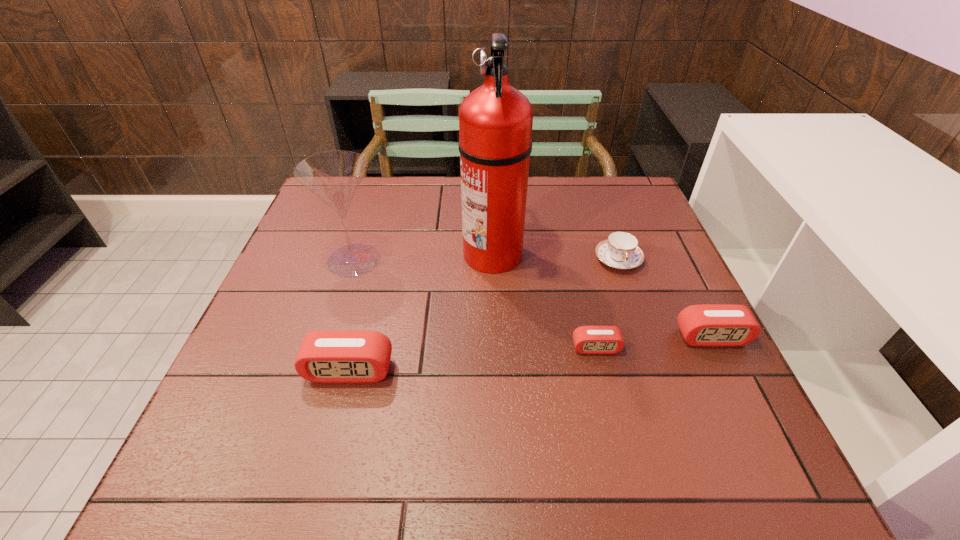
Locate an element on the screen. alarm clock that is at the right edge is located at coordinates (716, 325).

This screenshot has width=960, height=540. I want to click on teacup that is at the right edge, so click(621, 251).

Locate an element on the screen. object that is at the near left corner is located at coordinates (334, 356).

This screenshot has width=960, height=540. Identify the location of vacant space at the far edge of the desktop. (421, 193).

Find the location of a particular element. This screenshot has width=960, height=540. vacant region at the near edge of the desktop is located at coordinates (525, 389).

Image resolution: width=960 pixels, height=540 pixels. Identify the location of free space at the left edge. (303, 326).

Image resolution: width=960 pixels, height=540 pixels. What are the coordinates of `blank area at the right edge` in the screenshot? It's located at (644, 240).

In the image, there is a desktop. Where is `vacant space at the far right corner`? vacant space at the far right corner is located at coordinates (635, 197).

This screenshot has height=540, width=960. In order to click on free location at the near right corner in this screenshot , I will do `click(662, 401)`.

You are a GUI agent. You are given a task and a screenshot of the screen. Output one action in this format:
    pyautogui.click(x=<x>, y=<y>)
    Task: Click on the free point between the teacup and the nearest alarm clock
    
    Given the screenshot: What is the action you would take?
    pyautogui.click(x=484, y=315)